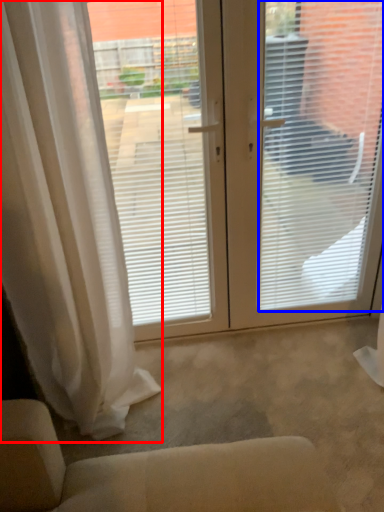
Question: Which point is closer to the camera, curtain (highlighted by a red box) or window blind (highlighted by a blue box)?

Choices:
 (A) curtain
 (B) window blind

Answer: (A)